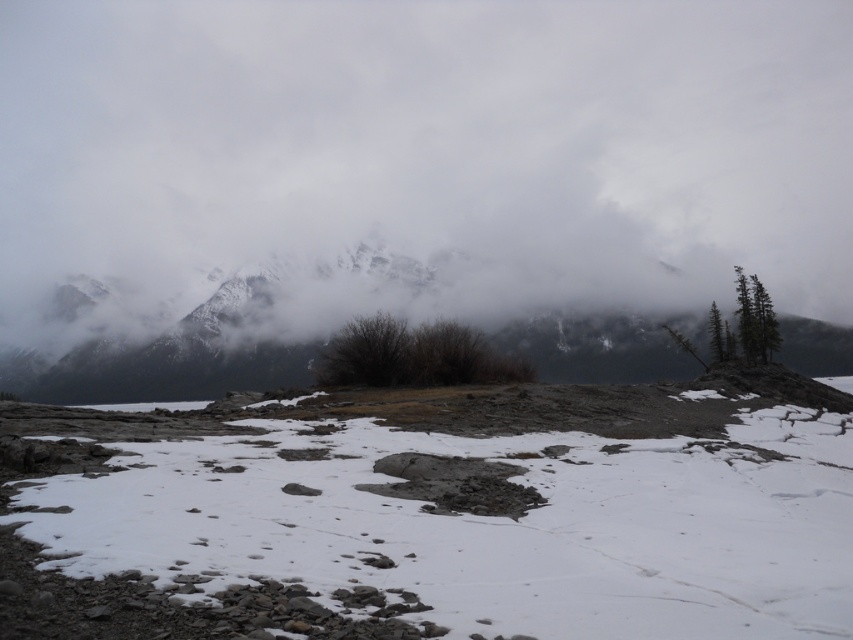
Can you confirm if white fluffy cloud at upper center is smaller than green matte tree at right?

Actually, white fluffy cloud at upper center might be larger than green matte tree at right.

Measure the distance from white fluffy cloud at upper center to green matte tree at right.

They are 198.61 meters apart.

Which is behind, point (312, 116) or point (743, 336)?

Positioned behind is point (312, 116).

Find the location of a particular element. The image size is (853, 640). white fluffy cloud at upper center is located at coordinates (422, 154).

Locate an element on the screen. white fluffy cloud at upper center is located at coordinates (422, 154).

The height and width of the screenshot is (640, 853). What do you see at coordinates (422, 154) in the screenshot? I see `white fluffy cloud at upper center` at bounding box center [422, 154].

Locate an element on the screen. Image resolution: width=853 pixels, height=640 pixels. white fluffy cloud at upper center is located at coordinates (422, 154).

Can you confirm if white fluffy cloud at upper center is wider than white powdery snow at center?

Yes, white fluffy cloud at upper center is wider than white powdery snow at center.

Which is in front, point (511, 4) or point (339, 588)?

Positioned in front is point (339, 588).

Between point (430, 12) and point (80, 531), which one is positioned in front?

Point (80, 531) is more forward.

Find the location of a particular element. Image resolution: width=853 pixels, height=640 pixels. white fluffy cloud at upper center is located at coordinates (422, 154).